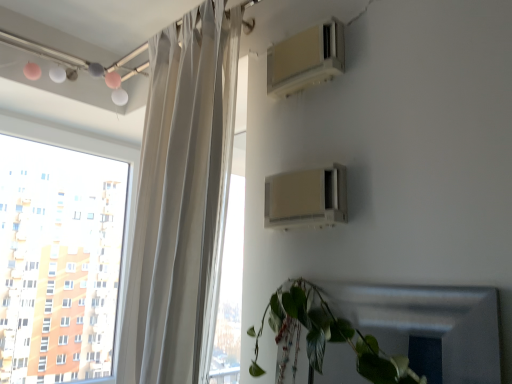
Question: Is green matte leafy plant at lower right to the right of transparent glass window at upper left from the viewer's perspective?

Choices:
 (A) no
 (B) yes

Answer: (B)

Question: Can you confirm if green matte leafy plant at lower right is smaller than transparent glass window at upper left?

Choices:
 (A) no
 (B) yes

Answer: (B)

Question: Can you confirm if green matte leafy plant at lower right is taller than transparent glass window at upper left?

Choices:
 (A) no
 (B) yes

Answer: (A)

Question: Considering the relative sizes of green matte leafy plant at lower right and transparent glass window at upper left in the image provided, is green matte leafy plant at lower right shorter than transparent glass window at upper left?

Choices:
 (A) no
 (B) yes

Answer: (B)

Question: Is green matte leafy plant at lower right to the left of transparent glass window at upper left from the viewer's perspective?

Choices:
 (A) yes
 (B) no

Answer: (B)

Question: Is green matte leafy plant at lower right completely or partially outside of transparent glass window at upper left?

Choices:
 (A) yes
 (B) no

Answer: (A)

Question: Is transparent glass window at upper left further to camera compared to white sheer curtain at left?

Choices:
 (A) no
 (B) yes

Answer: (B)

Question: Does transparent glass window at upper left have a larger size compared to white sheer curtain at left?

Choices:
 (A) no
 (B) yes

Answer: (A)

Question: Does transparent glass window at upper left have a smaller size compared to white sheer curtain at left?

Choices:
 (A) yes
 (B) no

Answer: (A)

Question: From a real-world perspective, is transparent glass window at upper left on white sheer curtain at left?

Choices:
 (A) yes
 (B) no

Answer: (B)

Question: From a real-world perspective, is transparent glass window at upper left under white sheer curtain at left?

Choices:
 (A) no
 (B) yes

Answer: (B)

Question: Is transparent glass window at upper left at the right side of white sheer curtain at left?

Choices:
 (A) no
 (B) yes

Answer: (A)

Question: Considering the relative sizes of transparent glass window at upper left and beige plastic air conditioner at upper right, the second air conditioning viewed from the top, in the image provided, is transparent glass window at upper left wider than beige plastic air conditioner at upper right, the second air conditioning viewed from the top,?

Choices:
 (A) no
 (B) yes

Answer: (B)